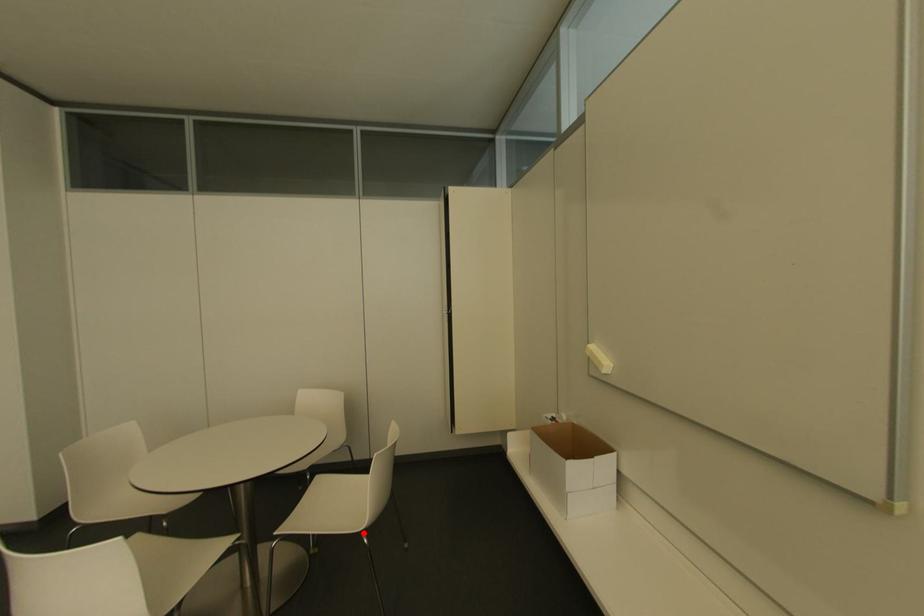
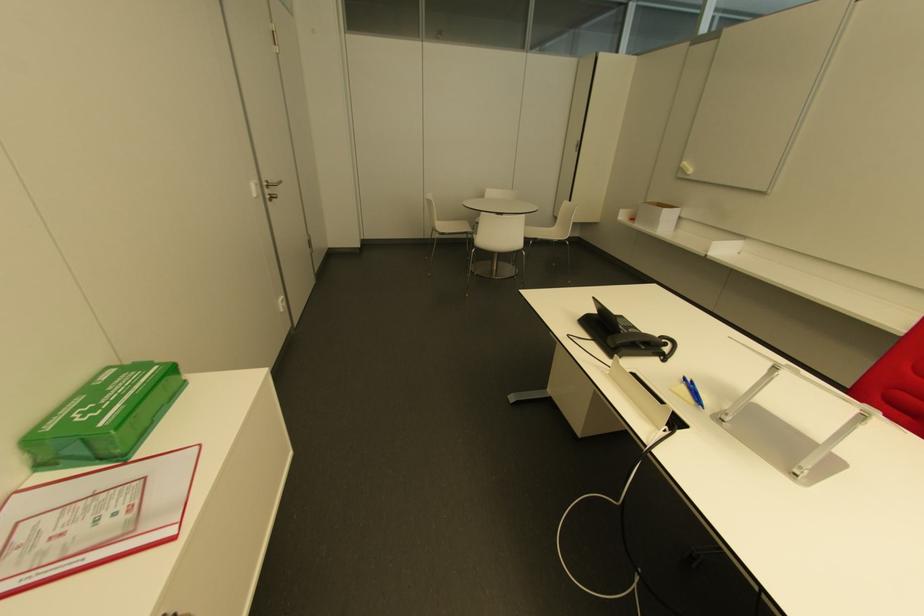
Question: I am providing you with two images of the same scene from different viewpoints. A red point is shown in image1. For the corresponding object point in image2, is it positioned nearer or farther from the camera?

Choices:
 (A) Nearer
 (B) Farther

Answer: (A)